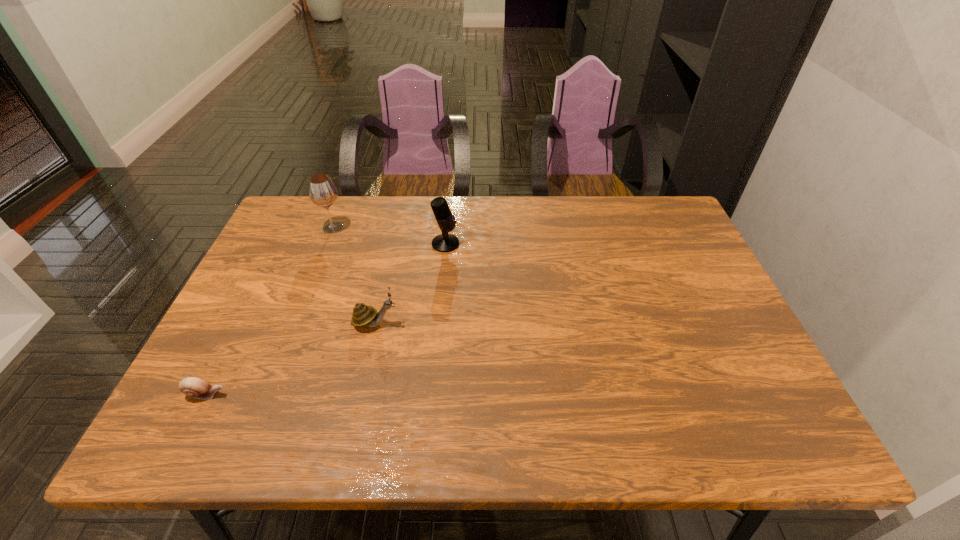
Find the location of `the second object from left to right`. the second object from left to right is located at coordinates (322, 192).

Locate an element on the screen. This screenshot has height=540, width=960. the rightmost object is located at coordinates (445, 242).

The width and height of the screenshot is (960, 540). I want to click on the second shortest object, so (x=363, y=315).

Locate an element on the screen. This screenshot has width=960, height=540. the second nearest object is located at coordinates (363, 315).

The width and height of the screenshot is (960, 540). What are the coordinates of `the leftmost object` in the screenshot? It's located at (194, 387).

The width and height of the screenshot is (960, 540). Identify the location of the nearest object. (194, 387).

Locate an element on the screen. This screenshot has width=960, height=540. free region located on the right of the second object from left to right is located at coordinates (465, 228).

Locate an element on the screen. This screenshot has height=540, width=960. vacant space located 0.110m on the stand of the rightmost object is located at coordinates (497, 244).

Where is `vacant space positioned 0.070m on the face of the right escargot`? Image resolution: width=960 pixels, height=540 pixels. vacant space positioned 0.070m on the face of the right escargot is located at coordinates (427, 323).

Where is `vacant space positioned 0.080m on the front-facing side of the left escargot`? Image resolution: width=960 pixels, height=540 pixels. vacant space positioned 0.080m on the front-facing side of the left escargot is located at coordinates (266, 394).